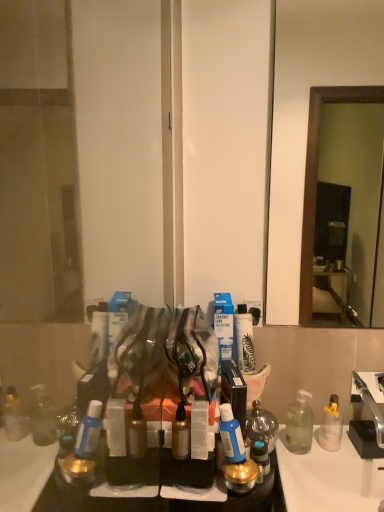
Question: Is clear plastic soap dispenser at lower right in front of blue glossy bottle at center, the third toiletry viewed from the left?

Choices:
 (A) yes
 (B) no

Answer: (B)

Question: From the image's perspective, is clear plastic soap dispenser at lower right under blue glossy bottle at center, the 3th toiletry from the right?

Choices:
 (A) yes
 (B) no

Answer: (A)

Question: From a real-world perspective, is clear plastic soap dispenser at lower right physically above blue glossy bottle at center, the third toiletry viewed from the left?

Choices:
 (A) yes
 (B) no

Answer: (B)

Question: Is blue glossy bottle at center, the third toiletry viewed from the left, at the back of clear plastic soap dispenser at lower right?

Choices:
 (A) yes
 (B) no

Answer: (B)

Question: Would you say clear plastic soap dispenser at lower right is outside blue glossy bottle at center, the third toiletry viewed from the left?

Choices:
 (A) yes
 (B) no

Answer: (A)

Question: Is silver metallic faucet at right wider or thinner than blue glossy bottle at center, the third toiletry viewed from the left?

Choices:
 (A) wide
 (B) thin

Answer: (A)

Question: Based on their positions, is silver metallic faucet at right located to the left or right of blue glossy bottle at center, the third toiletry viewed from the left?

Choices:
 (A) right
 (B) left

Answer: (A)

Question: In the image, is silver metallic faucet at right positioned in front of or behind blue glossy bottle at center, the 3th toiletry from the right?

Choices:
 (A) front
 (B) behind

Answer: (B)

Question: From a real-world perspective, is silver metallic faucet at right physically located above or below blue glossy bottle at center, the third toiletry viewed from the left?

Choices:
 (A) above
 (B) below

Answer: (B)

Question: Considering the positions of transparent plastic screen door at left and translucent glass jar at center, arranged as the 1th toiletry when viewed from the right, in the image, is transparent plastic screen door at left taller or shorter than translucent glass jar at center, arranged as the 1th toiletry when viewed from the right,?

Choices:
 (A) tall
 (B) short

Answer: (A)

Question: Considering the relative positions of transparent plastic screen door at left and translucent glass jar at center, the 5th toiletry from the left, in the image provided, is transparent plastic screen door at left to the left or to the right of translucent glass jar at center, the 5th toiletry from the left,?

Choices:
 (A) right
 (B) left

Answer: (B)

Question: From the image's perspective, is transparent plastic screen door at left positioned above or below translucent glass jar at center, the 5th toiletry from the left?

Choices:
 (A) below
 (B) above

Answer: (B)

Question: Is transparent plastic screen door at left spatially inside translucent glass jar at center, the 5th toiletry from the left, or outside of it?

Choices:
 (A) inside
 (B) outside

Answer: (B)

Question: Looking at the image, does translucent glass jar at center, the 5th toiletry from the left, seem bigger or smaller compared to blue glossy bottle at center, the third toiletry viewed from the left?

Choices:
 (A) small
 (B) big

Answer: (B)

Question: From the image's perspective, is translucent glass jar at center, arranged as the 1th toiletry when viewed from the right, positioned above or below blue glossy bottle at center, the 3th toiletry from the right?

Choices:
 (A) below
 (B) above

Answer: (A)